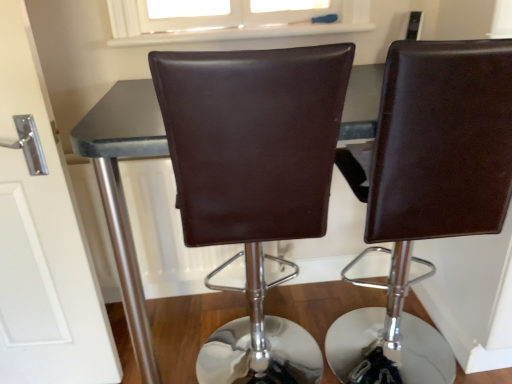
Question: In terms of width, does matte black table at center look wider or thinner when compared to brown leather chair at center, arranged as the second chair when viewed from the left?

Choices:
 (A) wide
 (B) thin

Answer: (A)

Question: Would you say matte black table at center is to the left or to the right of brown leather chair at center, arranged as the second chair when viewed from the left, in the picture?

Choices:
 (A) left
 (B) right

Answer: (A)

Question: Which object is positioned farthest from the matte black table at center?

Choices:
 (A) brown leather chair at center, which is the 1th chair in right-to-left order
 (B) brown leather chair at center, the second chair in the right-to-left sequence
 (C) white glossy door at left

Answer: (A)

Question: Estimate the real-world distances between objects in this image. Which object is farther from the brown leather chair at center, arranged as the second chair when viewed from the left?

Choices:
 (A) brown leather chair at center, positioned as the first chair in left-to-right order
 (B) white glossy door at left
 (C) matte black table at center

Answer: (B)